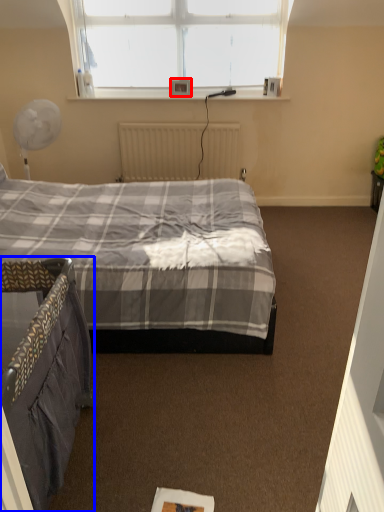
Question: Which object appears farthest to the camera in this image, picture frame (highlighted by a red box) or bed (highlighted by a blue box)?

Choices:
 (A) picture frame
 (B) bed

Answer: (A)